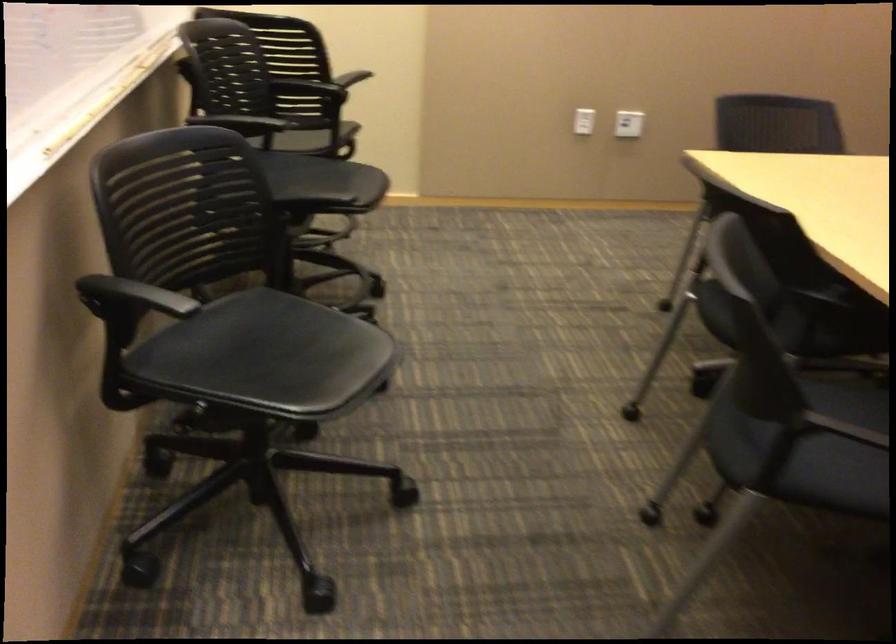
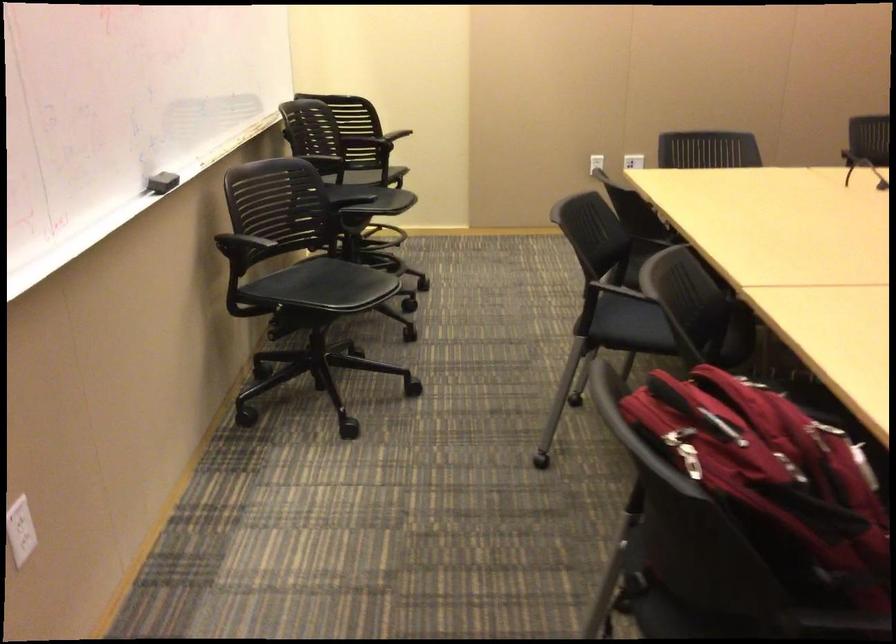
In the second image, find the point that corresponds to the point at 772,436 in the first image.

(629, 324)